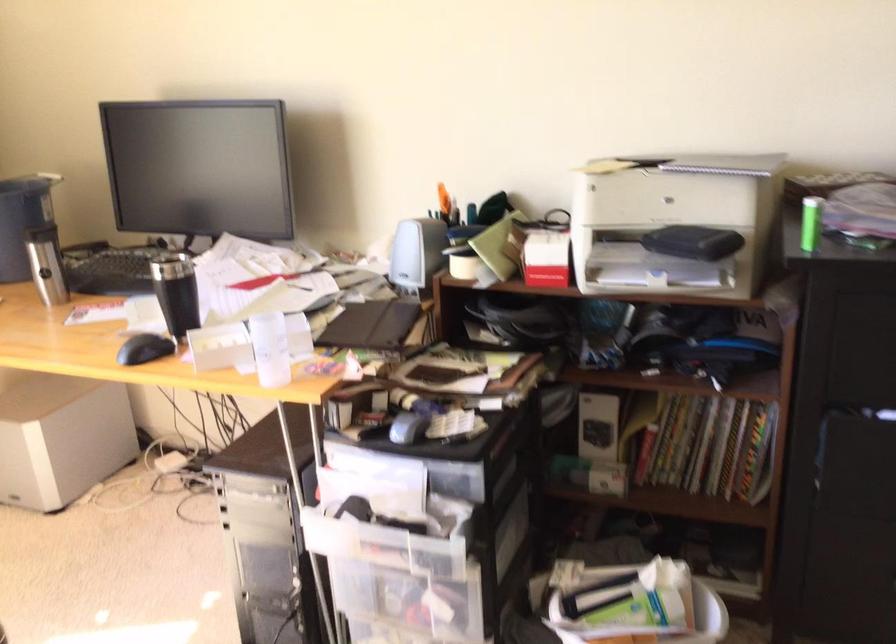
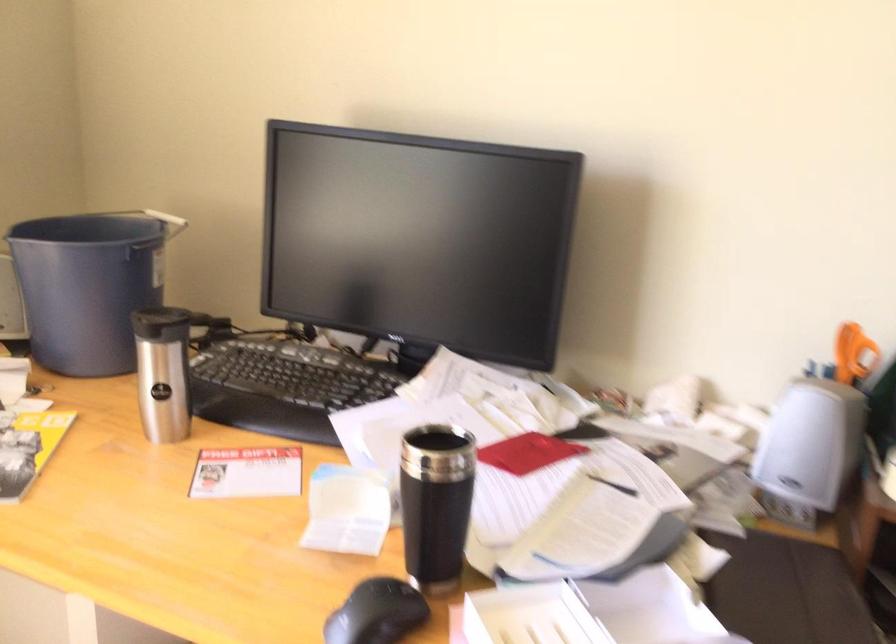
In a continuous first-person perspective shot, in which direction is the camera moving?

The movement direction of the cameraman is left, forward.